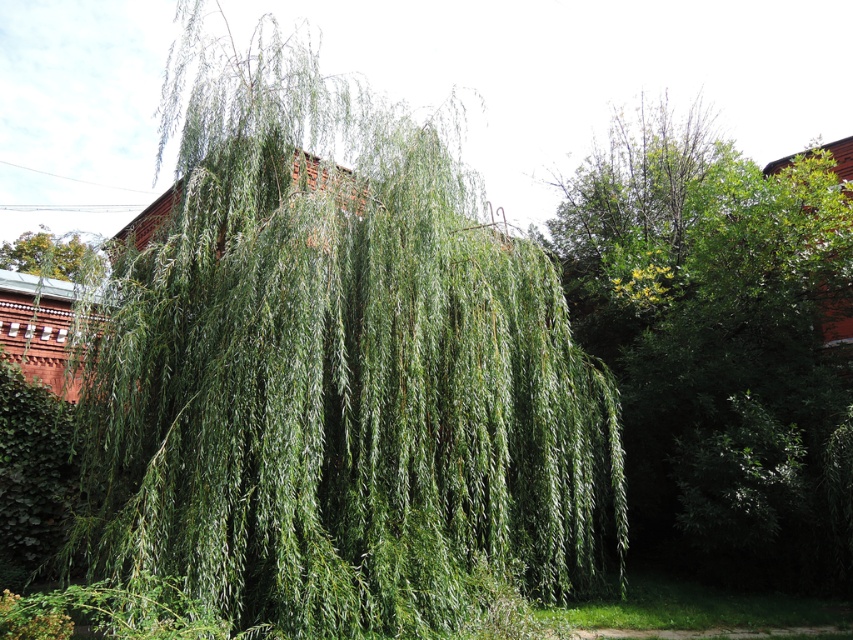
Question: Is green leafy willow at center above green leafy tree at upper left?

Choices:
 (A) no
 (B) yes

Answer: (A)

Question: Which object is the closest to the green leafy tree at center?

Choices:
 (A) green leafy willow at center
 (B) green leafy tree at upper left

Answer: (A)

Question: Is green leafy willow at center wider than green leafy tree at upper left?

Choices:
 (A) yes
 (B) no

Answer: (B)

Question: Is green leafy willow at center in front of green leafy tree at upper left?

Choices:
 (A) no
 (B) yes

Answer: (B)

Question: Which of the following is the farthest from the observer?

Choices:
 (A) [300, 330]
 (B) [50, 237]

Answer: (B)

Question: Considering the real-world distances, which object is farthest from the green leafy tree at upper left?

Choices:
 (A) green leafy willow at center
 (B) green leafy tree at center

Answer: (A)